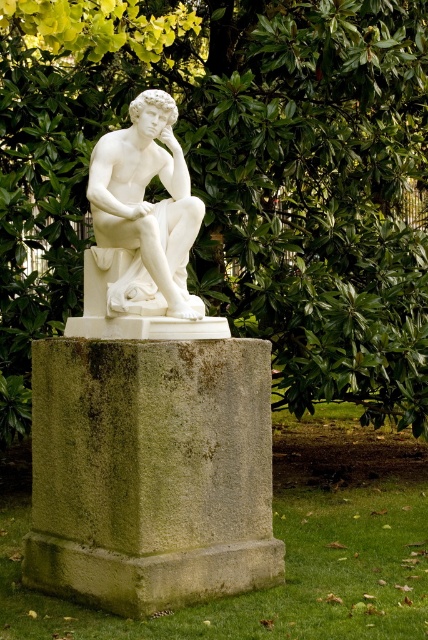
Question: Among these points, which one is farthest from the camera?

Choices:
 (A) (91, 170)
 (B) (50, 243)
 (C) (155, 529)

Answer: (B)

Question: Does green stone pedestal at center appear on the right side of white marble statue at center?

Choices:
 (A) yes
 (B) no

Answer: (B)

Question: Can you confirm if green leafy tree at upper center is positioned above white marble statue at center?

Choices:
 (A) yes
 (B) no

Answer: (B)

Question: Considering the real-world distances, which object is farthest from the green leafy tree at upper center?

Choices:
 (A) green stone pedestal at center
 (B) white marble statue at center

Answer: (A)

Question: Which point is farther from the camera taking this photo?

Choices:
 (A) (130, 156)
 (B) (62, 301)
 (C) (106, 486)

Answer: (B)

Question: Does green leafy tree at upper center have a greater width compared to white marble statue at center?

Choices:
 (A) no
 (B) yes

Answer: (A)